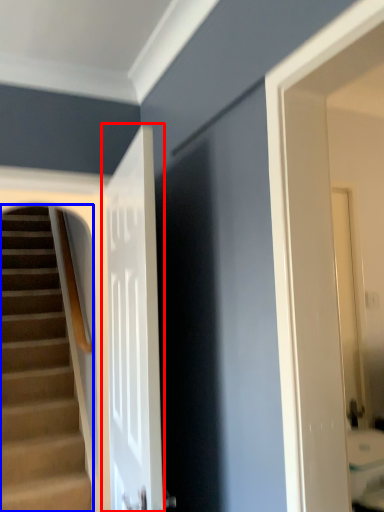
Question: Which object is closer to the camera taking this photo, door (highlighted by a red box) or stairs (highlighted by a blue box)?

Choices:
 (A) door
 (B) stairs

Answer: (A)